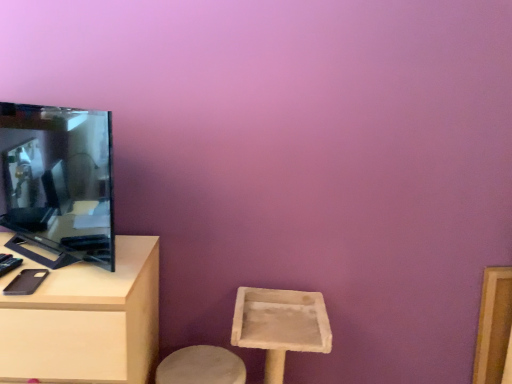
Question: Does light wood table at left appear on the left side of matte black tv at left?

Choices:
 (A) yes
 (B) no

Answer: (A)

Question: From a real-world perspective, is light wood table at left located beneath matte black tv at left?

Choices:
 (A) yes
 (B) no

Answer: (A)

Question: Would you say light wood table at left contains matte black tv at left?

Choices:
 (A) yes
 (B) no

Answer: (B)

Question: Considering the relative positions of light wood table at left and matte black tv at left in the image provided, is light wood table at left to the right of matte black tv at left from the viewer's perspective?

Choices:
 (A) no
 (B) yes

Answer: (A)

Question: Is matte black tv at left at the back of light wood table at left?

Choices:
 (A) no
 (B) yes

Answer: (A)

Question: Can you confirm if light wood table at left is shorter than matte black tv at left?

Choices:
 (A) no
 (B) yes

Answer: (A)

Question: Is matte black tv at left wider than light wood table at left?

Choices:
 (A) yes
 (B) no

Answer: (B)

Question: Is matte black tv at left positioned in front of light wood table at left?

Choices:
 (A) yes
 (B) no

Answer: (A)

Question: From the image's perspective, is matte black tv at left over light wood table at left?

Choices:
 (A) yes
 (B) no

Answer: (A)

Question: Does matte black tv at left have a greater height compared to light wood table at left?

Choices:
 (A) yes
 (B) no

Answer: (B)

Question: Is matte black tv at left bigger than light wood table at left?

Choices:
 (A) yes
 (B) no

Answer: (B)

Question: Can light wood table at left be found inside matte black tv at left?

Choices:
 (A) yes
 (B) no

Answer: (B)

Question: Relative to light wood table at left, is matte black tv at left in front or behind?

Choices:
 (A) front
 (B) behind

Answer: (A)